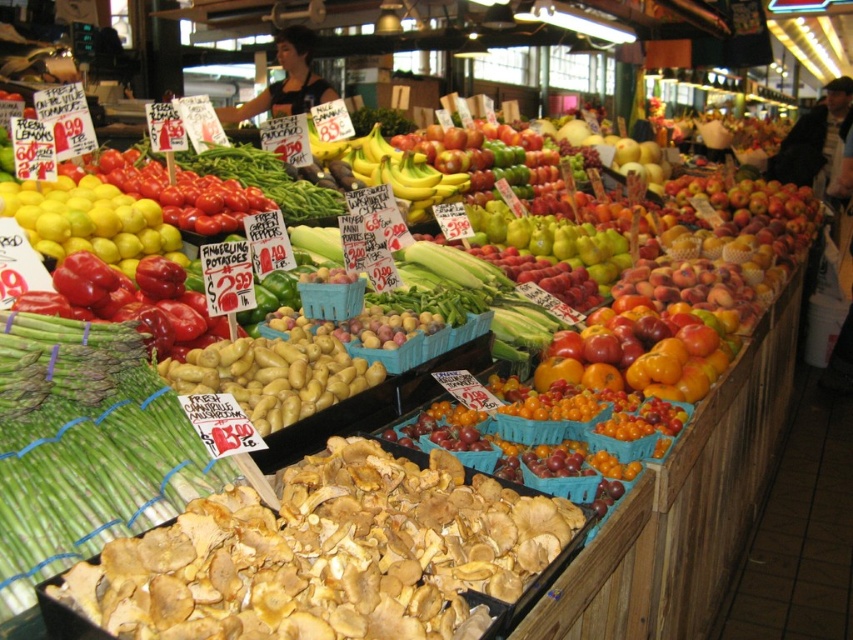
You are a customer at the market and want to buy both the green asparagus at left and the matte yellow lemons at left. If you have a small basket that can only hold items that are smaller than 10 inches, will both items fit?

The green asparagus at left is smaller than matte yellow lemons at left. Since the basket can hold items smaller than 10 inches, but the size comparison between them isn

You are standing in the produce section and want to locate the green asparagus at left. According to the coordinates provided, where should you look?

You should look at point (85, 448) to find the green asparagus at left.